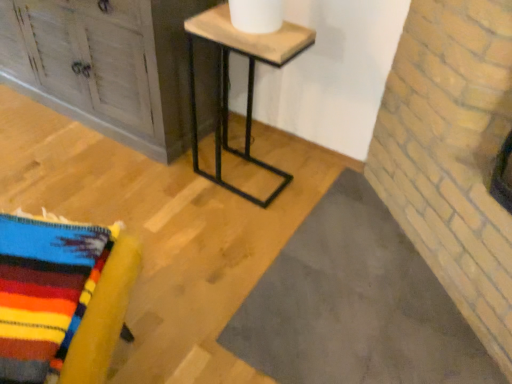
Question: Is the depth of distressed wood cabinet at upper left, arranged as the first furniture when viewed from the top, less than that of knitted wool blanket at lower left, which ranks as the first furniture in bottom-to-top order?

Choices:
 (A) yes
 (B) no

Answer: (B)

Question: Is distressed wood cabinet at upper left, which is the first furniture from back to front, oriented towards knitted wool blanket at lower left, which ranks as the first furniture in bottom-to-top order?

Choices:
 (A) yes
 (B) no

Answer: (A)

Question: Considering the relative sizes of distressed wood cabinet at upper left, which is the first furniture from back to front, and knitted wool blanket at lower left, which ranks as the 1th furniture in front-to-back order, in the image provided, is distressed wood cabinet at upper left, which is the first furniture from back to front, smaller than knitted wool blanket at lower left, which ranks as the 1th furniture in front-to-back order,?

Choices:
 (A) yes
 (B) no

Answer: (B)

Question: Considering the relative sizes of distressed wood cabinet at upper left, which is the second furniture from front to back, and knitted wool blanket at lower left, which ranks as the 1th furniture in front-to-back order, in the image provided, is distressed wood cabinet at upper left, which is the second furniture from front to back, thinner than knitted wool blanket at lower left, which ranks as the 1th furniture in front-to-back order,?

Choices:
 (A) no
 (B) yes

Answer: (A)

Question: Is distressed wood cabinet at upper left, which is the first furniture from back to front, to the left of knitted wool blanket at lower left, which is the second furniture in back-to-front order, from the viewer's perspective?

Choices:
 (A) yes
 (B) no

Answer: (A)

Question: Considering the positions of point (221, 18) and point (20, 66), is point (221, 18) closer or farther from the camera than point (20, 66)?

Choices:
 (A) farther
 (B) closer

Answer: (B)

Question: In terms of width, does wooden/marble table at center look wider or thinner when compared to distressed wood cabinet at upper left, the 2th furniture positioned from the bottom?

Choices:
 (A) wide
 (B) thin

Answer: (B)

Question: Is wooden/marble table at center taller or shorter than distressed wood cabinet at upper left, which is the second furniture from front to back?

Choices:
 (A) short
 (B) tall

Answer: (A)

Question: From a real-world perspective, is wooden/marble table at center above or below distressed wood cabinet at upper left, which is the second furniture from front to back?

Choices:
 (A) below
 (B) above

Answer: (A)

Question: From a real-world perspective, is knitted wool blanket at lower left, which ranks as the first furniture in bottom-to-top order, physically located above or below wooden/marble table at center?

Choices:
 (A) above
 (B) below

Answer: (B)

Question: In the image, is knitted wool blanket at lower left, which ranks as the first furniture in bottom-to-top order, positioned in front of or behind wooden/marble table at center?

Choices:
 (A) behind
 (B) front

Answer: (B)

Question: In terms of width, does knitted wool blanket at lower left, which ranks as the 1th furniture in front-to-back order, look wider or thinner when compared to wooden/marble table at center?

Choices:
 (A) wide
 (B) thin

Answer: (A)

Question: Does point (40, 276) appear closer or farther from the camera than point (209, 36)?

Choices:
 (A) closer
 (B) farther

Answer: (A)

Question: Looking at their shapes, would you say wooden/marble table at center is wider or thinner than knitted wool blanket at lower left, which ranks as the 1th furniture in front-to-back order?

Choices:
 (A) thin
 (B) wide

Answer: (A)

Question: Is wooden/marble table at center spatially inside knitted wool blanket at lower left, positioned as the second furniture in top-to-bottom order, or outside of it?

Choices:
 (A) inside
 (B) outside

Answer: (B)